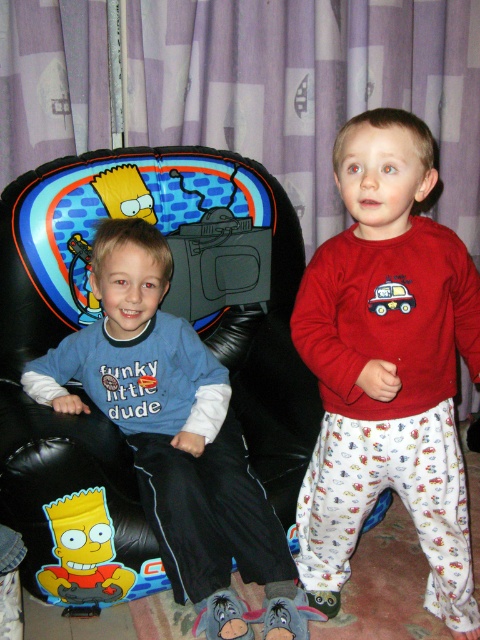
Question: Which point is closer to the camera?

Choices:
 (A) (371, 301)
 (B) (202, 408)
 (C) (110, 586)

Answer: (A)

Question: Does matte blue shirt at center appear under yellow matte bart simpson at left?

Choices:
 (A) yes
 (B) no

Answer: (B)

Question: Which object is the closest to the matte blue shirt at center?

Choices:
 (A) matte plastic car at right
 (B) yellow matte bart simpson at left
 (C) red cotton pajamas at right

Answer: (B)

Question: Is matte blue shirt at center positioned behind matte plastic car at right?

Choices:
 (A) yes
 (B) no

Answer: (A)

Question: Which object appears closest to the camera in this image?

Choices:
 (A) yellow matte bart simpson at left
 (B) red cotton pajamas at right
 (C) matte plastic car at right

Answer: (B)

Question: Does matte blue shirt at center appear over yellow matte bart simpson at left?

Choices:
 (A) yes
 (B) no

Answer: (A)